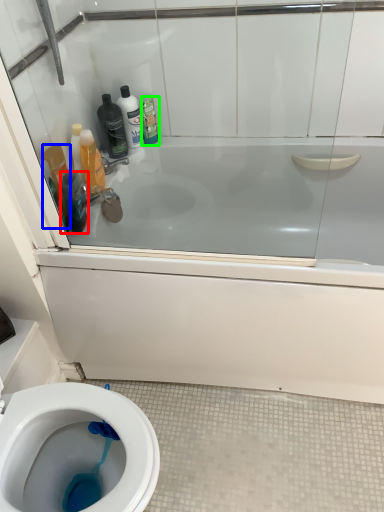
Question: Which is farther away from mouthwash (highlighted by a red box)? mouthwash (highlighted by a blue box) or cleaning product (highlighted by a green box)?

Choices:
 (A) mouthwash
 (B) cleaning product

Answer: (B)